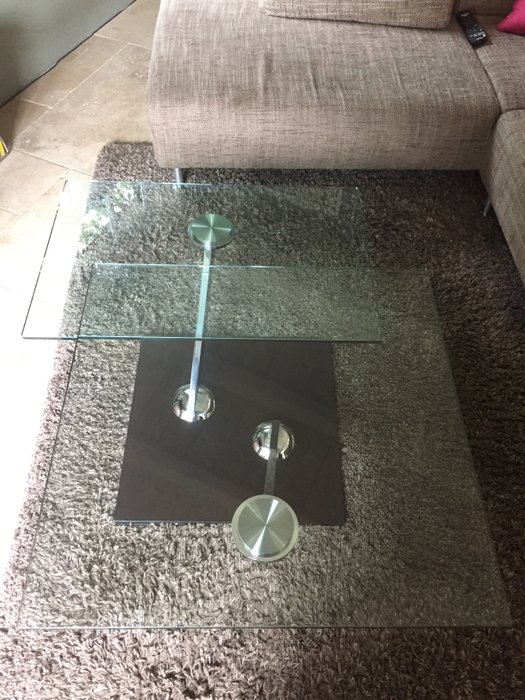
This screenshot has width=525, height=700. What are the coordinates of `tan tiled floor` in the screenshot? It's located at (113, 83).